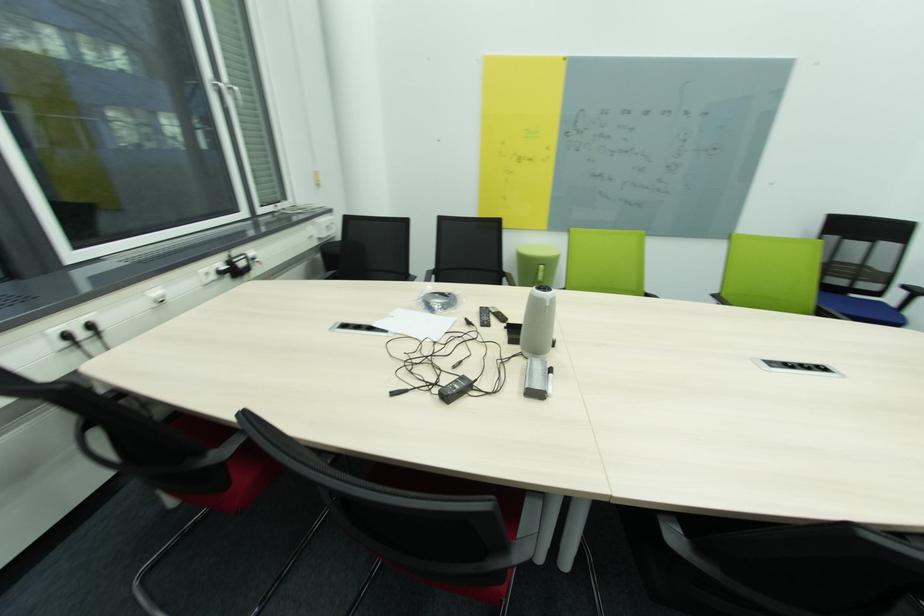
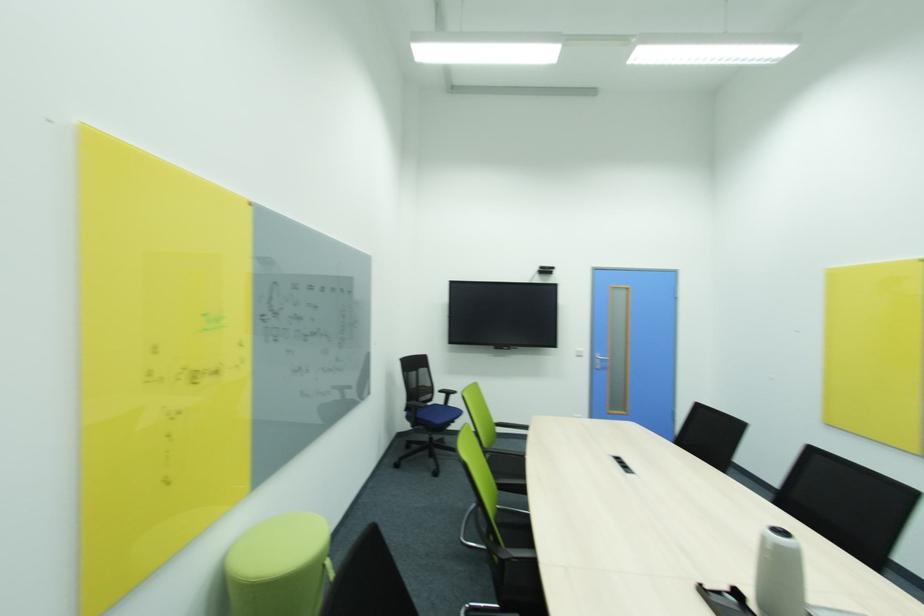
Find the pixel in the second image that matches (892,246) in the first image.

(428, 371)